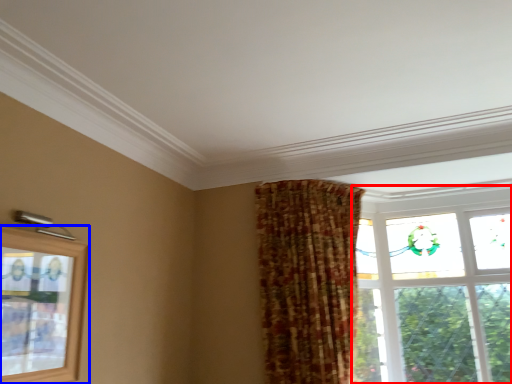
Question: Which of the following is the farthest to the observer, window (highlighted by a red box) or window (highlighted by a blue box)?

Choices:
 (A) window
 (B) window

Answer: (A)